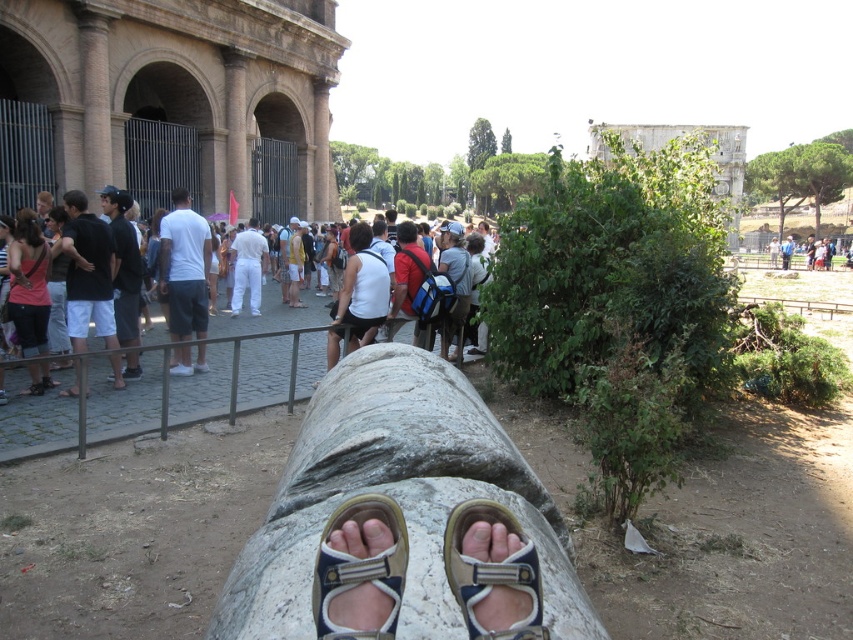
You are standing at the ancient Roman site and want to take a photo of the two points mentioned. Which point, point (381, 621) or point (457, 564), is closer to you?

Point (381, 621) is closer to the viewer than point (457, 564).

You are a tour guide leading a group at an ancient Roman site. You notice a tourist wearing a tan fabric sandal at center and a white cotton shirt at center. Which clothing item is located to the left when viewed from the front?

The tan fabric sandal at center is positioned on the left side of the white cotton shirt at center, so the sandal is to the left when viewed from the front.

You are standing at the ancient Roman site near the Colosseum. You see two points marked on the ground at coordinates point [305,538] and point [846,236]. If you want to walk from the first point to the second point, which direction should you move relative to your current position?

You should move backward because point [305,538] is in front of point [846,236], meaning the second point is behind the first point from your perspective.